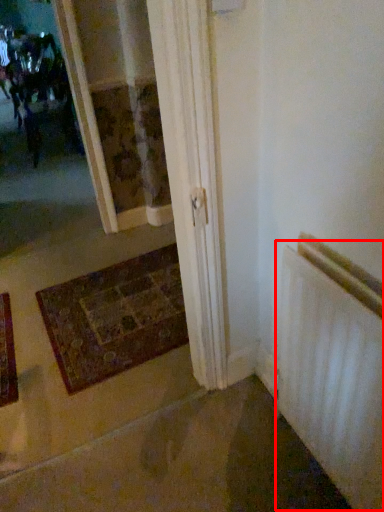
Question: From the image's perspective, where is radiator (annotated by the red box) located relative to mat?

Choices:
 (A) below
 (B) above

Answer: (A)